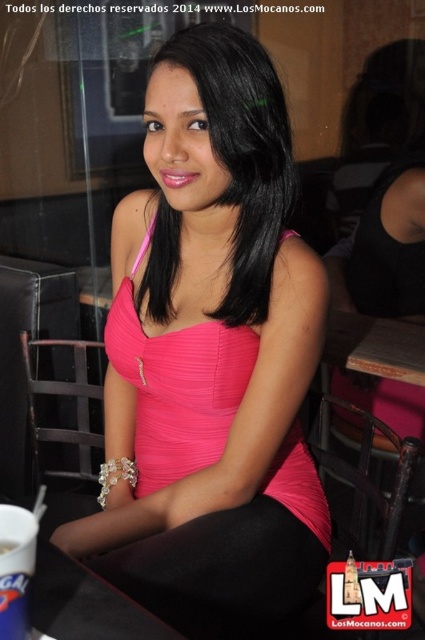
Is matte pink dress at center bigger than black leather table at lower left?

Correct, matte pink dress at center is larger in size than black leather table at lower left.

Can you confirm if matte pink dress at center is positioned to the right of black leather table at lower left?

Indeed, matte pink dress at center is positioned on the right side of black leather table at lower left.

Which is behind, point (252, 499) or point (74, 572)?

Point (252, 499)

At what (x,y) coordinates should I click in order to perform the action: click on matte pink dress at center. Please return your answer as a coordinate pair (x, y). This screenshot has width=425, height=640. Looking at the image, I should click on tap(209, 353).

From the picture: Is pink satin dress at center further to camera compared to pink satin blouse at center?

That is True.

Who is more distant from viewer, (317, 486) or (286, 136)?

The point (317, 486) is more distant.

Is point (320, 536) positioned behind point (212, 109)?

That is True.

The image size is (425, 640). Identify the location of pink satin dress at center. (176, 388).

Is black leather table at lower left thinner than white plastic cup at lower left?

No.

Which is in front, point (45, 595) or point (2, 584)?

Point (2, 584) is in front.

Image resolution: width=425 pixels, height=640 pixels. I want to click on black leather table at lower left, so point(85,604).